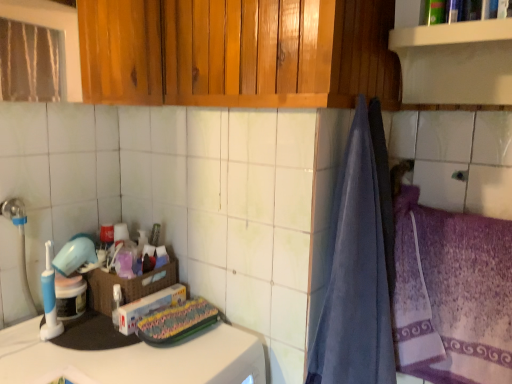
Question: Is translucent plastic container at center at the left side of woven brown basket at center?

Choices:
 (A) no
 (B) yes

Answer: (A)

Question: Would you say translucent plastic container at center is outside woven brown basket at center?

Choices:
 (A) yes
 (B) no

Answer: (B)

Question: Is translucent plastic container at center looking in the opposite direction of woven brown basket at center?

Choices:
 (A) no
 (B) yes

Answer: (B)

Question: From a real-world perspective, is translucent plastic container at center beneath woven brown basket at center?

Choices:
 (A) yes
 (B) no

Answer: (B)

Question: Does translucent plastic container at center touch woven brown basket at center?

Choices:
 (A) no
 (B) yes

Answer: (A)

Question: Is point (496, 54) positioned closer to the camera than point (162, 259)?

Choices:
 (A) closer
 (B) farther

Answer: (A)

Question: From the image's perspective, is white matte shelf at upper right above or below translucent plastic container at center?

Choices:
 (A) below
 (B) above

Answer: (B)

Question: In terms of width, does white matte shelf at upper right look wider or thinner when compared to translucent plastic container at center?

Choices:
 (A) wide
 (B) thin

Answer: (A)

Question: From a real-world perspective, relative to translucent plastic container at center, is white matte shelf at upper right vertically above or below?

Choices:
 (A) above
 (B) below

Answer: (A)

Question: From the image's perspective, is blue soft towel at right above or below purple textured towel at right?

Choices:
 (A) above
 (B) below

Answer: (A)

Question: From a real-world perspective, is blue soft towel at right above or below purple textured towel at right?

Choices:
 (A) below
 (B) above

Answer: (B)

Question: Relative to purple textured towel at right, is blue soft towel at right in front or behind?

Choices:
 (A) front
 (B) behind

Answer: (A)

Question: Looking at the image, does blue soft towel at right seem bigger or smaller compared to purple textured towel at right?

Choices:
 (A) big
 (B) small

Answer: (A)

Question: Is translucent plastic container at center wider or thinner than purple textured towel at right?

Choices:
 (A) wide
 (B) thin

Answer: (B)

Question: From the image's perspective, is translucent plastic container at center located above or below purple textured towel at right?

Choices:
 (A) above
 (B) below

Answer: (A)